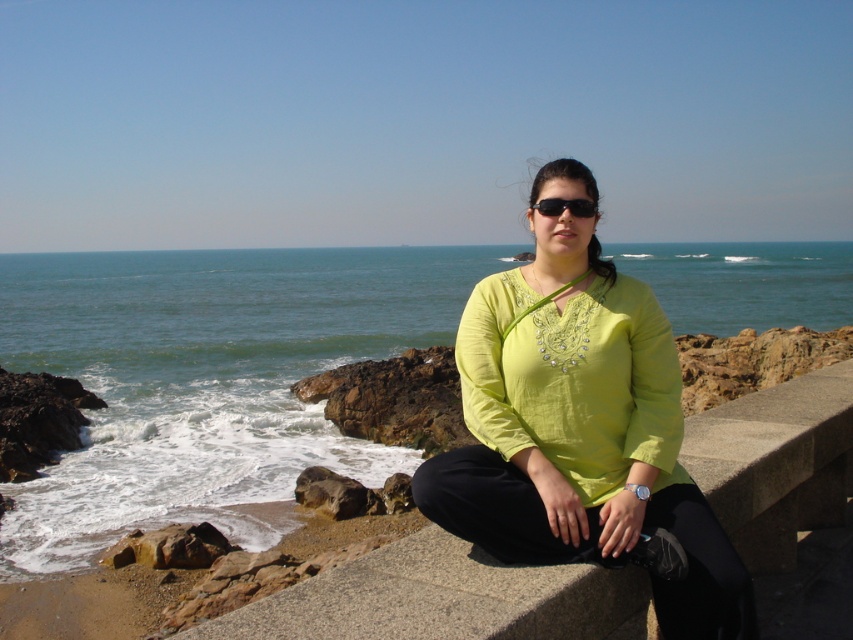
Does blue water at center appear over black plastic sunglasses at center?

Yes, blue water at center is above black plastic sunglasses at center.

Measure the distance between blue water at center and black plastic sunglasses at center.

blue water at center and black plastic sunglasses at center are 233.29 feet apart.

The image size is (853, 640). What do you see at coordinates (209, 380) in the screenshot? I see `blue water at center` at bounding box center [209, 380].

Find the location of a particular element. The image size is (853, 640). blue water at center is located at coordinates (209, 380).

Is blue water at center taller than lime green fabric at center?

Indeed, blue water at center has a greater height compared to lime green fabric at center.

Does point (88, 340) come closer to viewer compared to point (699, 532)?

No, (88, 340) is behind (699, 532).

Locate an element on the screen. The image size is (853, 640). blue water at center is located at coordinates (209, 380).

Can you confirm if lime green fabric at center is positioned above black plastic sunglasses at center?

Incorrect, lime green fabric at center is not positioned above black plastic sunglasses at center.

Is point (532, 506) farther from viewer compared to point (579, 212)?

That is False.

Is point (734, 588) farther from viewer compared to point (553, 208)?

No, (734, 588) is closer to viewer.

The width and height of the screenshot is (853, 640). I want to click on lime green fabric at center, so tap(579, 424).